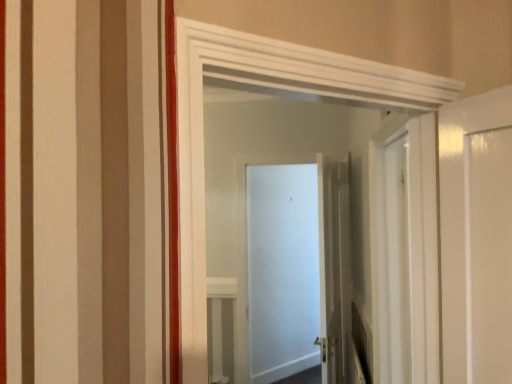
The width and height of the screenshot is (512, 384). I want to click on white matte door at center, the 1th door from the back, so click(x=319, y=245).

This screenshot has width=512, height=384. Describe the element at coordinates (319, 245) in the screenshot. I see `white matte door at center, the 1th door from the back` at that location.

Where is `white glossy door at center, the 2th door from the back`? The height and width of the screenshot is (384, 512). white glossy door at center, the 2th door from the back is located at coordinates (334, 267).

The width and height of the screenshot is (512, 384). Find the location of `white matte door at center, arranged as the third door when viewed from the front`. white matte door at center, arranged as the third door when viewed from the front is located at coordinates (319, 245).

Which is less distant, (x=326, y=211) or (x=349, y=265)?

Point (x=326, y=211) is farther from the camera than point (x=349, y=265).

Identify the location of door that is behind the white glossy door at center, the 2th door from the back. (319, 245).

Is white glossy door at center, the 2th door from the back, far away from white matte door at center, arranged as the third door when viewed from the front?

That's not correct — white glossy door at center, the 2th door from the back, is a little close to white matte door at center, arranged as the third door when viewed from the front.

Considering the relative positions of white glossy door at center, the 2th door from the back, and white matte door at center, the 1th door from the back, in the image provided, is white glossy door at center, the 2th door from the back, to the left of white matte door at center, the 1th door from the back, from the viewer's perspective?

No.

Between white matte door at center, the 1th door from the back, and white glossy door at center, the first door positioned from the front, which one is positioned in front?

Positioned in front is white glossy door at center, the first door positioned from the front.

Which object is positioned more to the right, white matte door at center, the 1th door from the back, or white glossy door at center, the first door positioned from the front?

From the viewer's perspective, white matte door at center, the 1th door from the back, appears more on the right side.

Considering the sizes of objects white matte door at center, the 1th door from the back, and white glossy door at center, which appears as the 3th door when viewed from the back, in the image provided, who is taller, white matte door at center, the 1th door from the back, or white glossy door at center, which appears as the 3th door when viewed from the back,?

With more height is white matte door at center, the 1th door from the back.

In terms of size, does white matte door at center, the 1th door from the back, appear bigger or smaller than white glossy door at center, which appears as the 3th door when viewed from the back?

Clearly, white matte door at center, the 1th door from the back, is smaller in size than white glossy door at center, which appears as the 3th door when viewed from the back.

Is white glossy door at center, the 2th door from the back, wider than white glossy door at center, which appears as the 3th door when viewed from the back?

Indeed, white glossy door at center, the 2th door from the back, has a greater width compared to white glossy door at center, which appears as the 3th door when viewed from the back.

Is the depth of white glossy door at center, the 2th door from the back, less than that of white glossy door at center, the first door positioned from the front?

No, white glossy door at center, the 2th door from the back, is behind white glossy door at center, the first door positioned from the front.

Which is behind, point (332, 316) or point (238, 65)?

Positioned behind is point (332, 316).

Is white glossy door at center, which ranks as the second door in front-to-back order, shorter than white glossy door at center, the first door positioned from the front?

No, white glossy door at center, which ranks as the second door in front-to-back order, is not shorter than white glossy door at center, the first door positioned from the front.

Who is more distant, white glossy door at center, the first door positioned from the front, or white glossy door at center, the 2th door from the back?

white glossy door at center, the 2th door from the back, is further from the camera.

From the picture: Is white glossy door at center, the 2th door from the back, inside white glossy door at center, which appears as the 3th door when viewed from the back?

No, white glossy door at center, which appears as the 3th door when viewed from the back, does not contain white glossy door at center, the 2th door from the back.

Is white glossy door at center, which appears as the 3th door when viewed from the back, next to white glossy door at center, the 2th door from the back?

No, white glossy door at center, which appears as the 3th door when viewed from the back, is not in contact with white glossy door at center, the 2th door from the back.

From the image's perspective, is white glossy door at center, the first door positioned from the front, located above or below white glossy door at center, the 2th door from the back?

Clearly, from the image's perspective, white glossy door at center, the first door positioned from the front, is above white glossy door at center, the 2th door from the back.

Between white matte door at center, the 1th door from the back, and white glossy door at center, which ranks as the second door in front-to-back order, which one has smaller size?

Smaller between the two is white matte door at center, the 1th door from the back.

Can you tell me how much white matte door at center, the 1th door from the back, and white glossy door at center, the 2th door from the back, differ in facing direction?

The angle between the facing direction of white matte door at center, the 1th door from the back, and the facing direction of white glossy door at center, the 2th door from the back, is 86.4 degrees.

Is point (241, 346) less distant than point (348, 315)?

No, (241, 346) is behind (348, 315).

Is white glossy door at center, the first door positioned from the front, thinner than white matte door at center, arranged as the third door when viewed from the front?

In fact, white glossy door at center, the first door positioned from the front, might be wider than white matte door at center, arranged as the third door when viewed from the front.

From the picture: From a real-world perspective, between white glossy door at center, which appears as the 3th door when viewed from the back, and white matte door at center, the 1th door from the back, who is vertically higher?

white glossy door at center, which appears as the 3th door when viewed from the back, from a real-world perspective.

From the image's perspective, which is above, white glossy door at center, which appears as the 3th door when viewed from the back, or white matte door at center, arranged as the third door when viewed from the front?

white glossy door at center, which appears as the 3th door when viewed from the back, is shown above in the image.

Is white glossy door at center, the first door positioned from the front, looking in the opposite direction of white matte door at center, the 1th door from the back?

No.

Where is `the 1st door positioned above the white matte door at center, arranged as the third door when viewed from the front (from a real-world perspective)`? This screenshot has height=384, width=512. the 1st door positioned above the white matte door at center, arranged as the third door when viewed from the front (from a real-world perspective) is located at coordinates (334, 267).

There is a white glossy door at center, which appears as the 3th door when viewed from the back. At what (x,y) coordinates should I click in order to perform the action: click on the 2nd door below it (from the image's perspective). Please return your answer as a coordinate pair (x, y). The image size is (512, 384). Looking at the image, I should click on (319, 245).

Looking at the image, which one is located closer to white glossy door at center, the first door positioned from the front, white glossy door at center, which ranks as the second door in front-to-back order, or white matte door at center, the 1th door from the back?

white glossy door at center, which ranks as the second door in front-to-back order, is closer to white glossy door at center, the first door positioned from the front.

Looking at the image, which one is located further to white matte door at center, arranged as the third door when viewed from the front, white glossy door at center, the 2th door from the back, or white glossy door at center, the first door positioned from the front?

Based on the image, white glossy door at center, the first door positioned from the front, appears to be further to white matte door at center, arranged as the third door when viewed from the front.

Considering their positions, is white matte door at center, the 1th door from the back, positioned further to white glossy door at center, the first door positioned from the front, than white glossy door at center, which ranks as the second door in front-to-back order?

The object further to white glossy door at center, the first door positioned from the front, is white matte door at center, the 1th door from the back.

Considering their positions, is white glossy door at center, the first door positioned from the front, positioned closer to white matte door at center, arranged as the third door when viewed from the front, than white glossy door at center, which ranks as the second door in front-to-back order?

white glossy door at center, which ranks as the second door in front-to-back order.

From the image, which object appears to be nearer to white glossy door at center, which ranks as the second door in front-to-back order, white glossy door at center, the first door positioned from the front, or white matte door at center, arranged as the third door when viewed from the front?

The object closer to white glossy door at center, which ranks as the second door in front-to-back order, is white matte door at center, arranged as the third door when viewed from the front.

From the image, which object appears to be nearer to white glossy door at center, the 2th door from the back, white matte door at center, the 1th door from the back, or white glossy door at center, the first door positioned from the front?

white matte door at center, the 1th door from the back, lies closer to white glossy door at center, the 2th door from the back, than the other object.

Where is `door between white glossy door at center, which appears as the 3th door when viewed from the back, and white matte door at center, the 1th door from the back, from front to back`? This screenshot has width=512, height=384. door between white glossy door at center, which appears as the 3th door when viewed from the back, and white matte door at center, the 1th door from the back, from front to back is located at coordinates (334, 267).